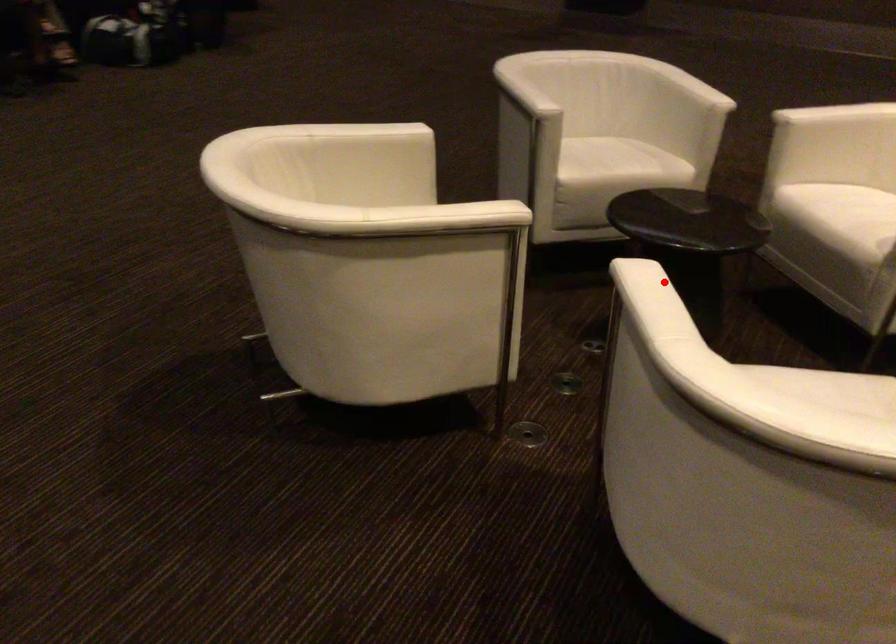
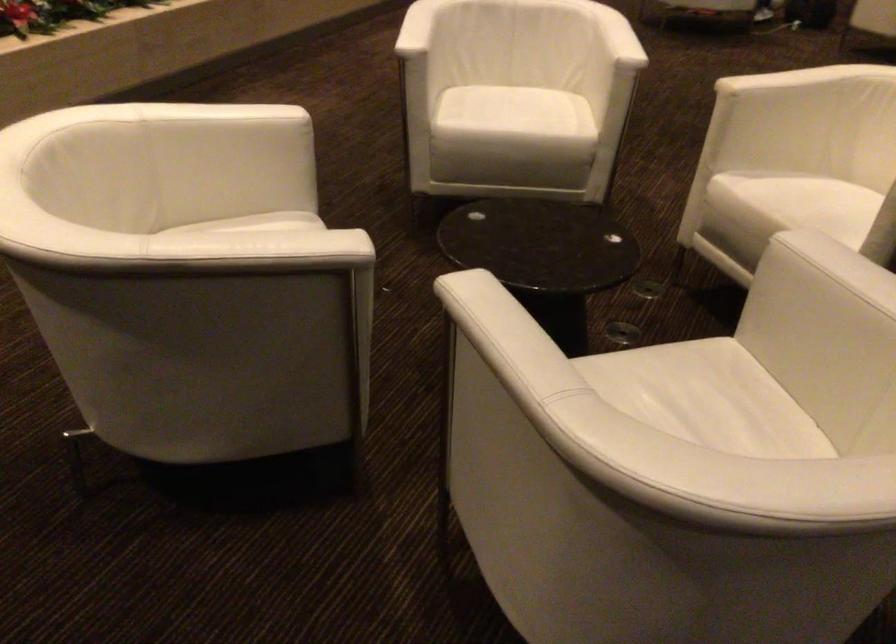
Question: I am providing you with two images of the same scene from different viewpoints. Image1 has a red point marked. In image2, the corresponding 3D location appears at what relative position? Reply with the corresponding letter.

Choices:
 (A) Closer
 (B) Farther

Answer: (B)